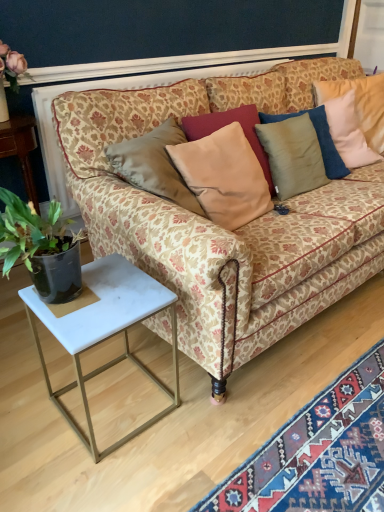
Question: Considering the positions of point (107, 273) and point (49, 264), is point (107, 273) closer or farther from the camera than point (49, 264)?

Choices:
 (A) closer
 (B) farther

Answer: (B)

Question: Considering the positions of white marble side table at lower left and green leafy plant at left in the image, is white marble side table at lower left wider or thinner than green leafy plant at left?

Choices:
 (A) thin
 (B) wide

Answer: (B)

Question: Which of these objects is positioned closest to the white marble side table at lower left?

Choices:
 (A) green leafy plant at left
 (B) carpet with intricate patterns at lower right
 (C) patterned fabric couch at center
 (D) satin beige pillow at center

Answer: (A)

Question: Which of these objects is positioned farthest from the white marble side table at lower left?

Choices:
 (A) patterned fabric couch at center
 (B) green leafy plant at left
 (C) carpet with intricate patterns at lower right
 (D) satin beige pillow at center

Answer: (D)